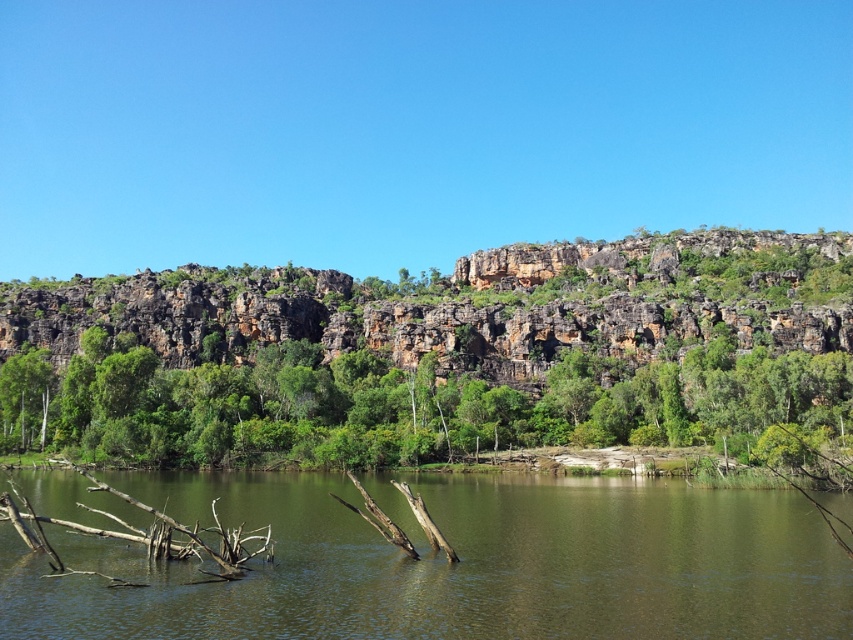
Does greenish-brown water at center have a greater height compared to green leafy tree at center?

In fact, greenish-brown water at center may be shorter than green leafy tree at center.

Can you confirm if greenish-brown water at center is bigger than green leafy tree at center?

Actually, greenish-brown water at center might be smaller than green leafy tree at center.

Does point (474, 561) lie behind point (846, 372)?

No, it is in front of (846, 372).

You are a GUI agent. You are given a task and a screenshot of the screen. Output one action in this format:
    pyautogui.click(x=<x>, y=<y>)
    Task: Click on the greenish-brown water at center
    
    Given the screenshot: What is the action you would take?
    pyautogui.click(x=454, y=563)